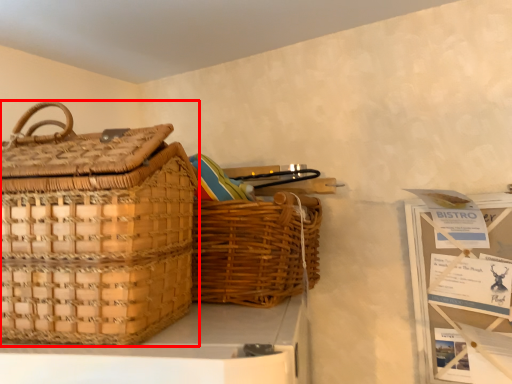
Question: Observing the image, what is the correct spatial positioning of picnic basket (annotated by the red box) in reference to picnic basket?

Choices:
 (A) left
 (B) right

Answer: (A)